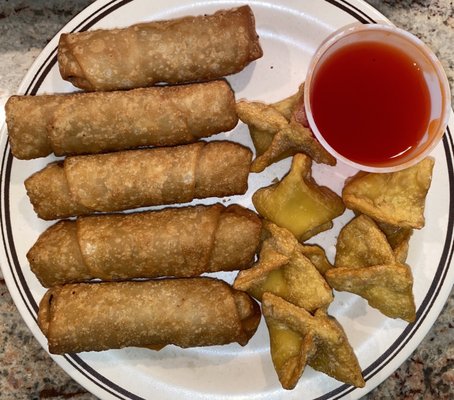
You are a GUI agent. You are given a task and a screenshot of the screen. Output one action in this format:
    pyautogui.click(x=<x>, y=<y>)
    Task: Click on the black stripes on plate
    Image resolution: width=454 pixels, height=400 pixels.
    Given the screenshot: What is the action you would take?
    pyautogui.click(x=396, y=345), pyautogui.click(x=399, y=348), pyautogui.click(x=80, y=362), pyautogui.click(x=76, y=367)